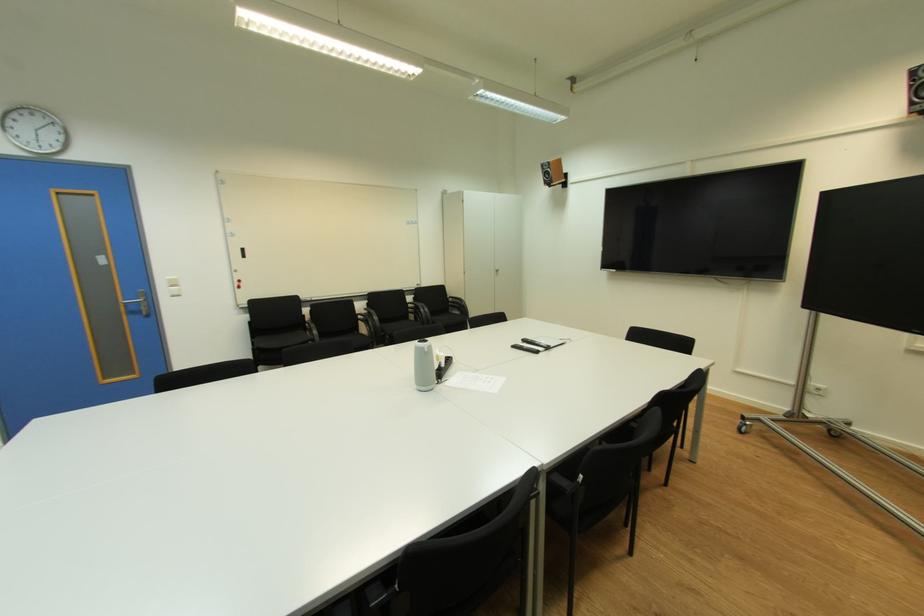
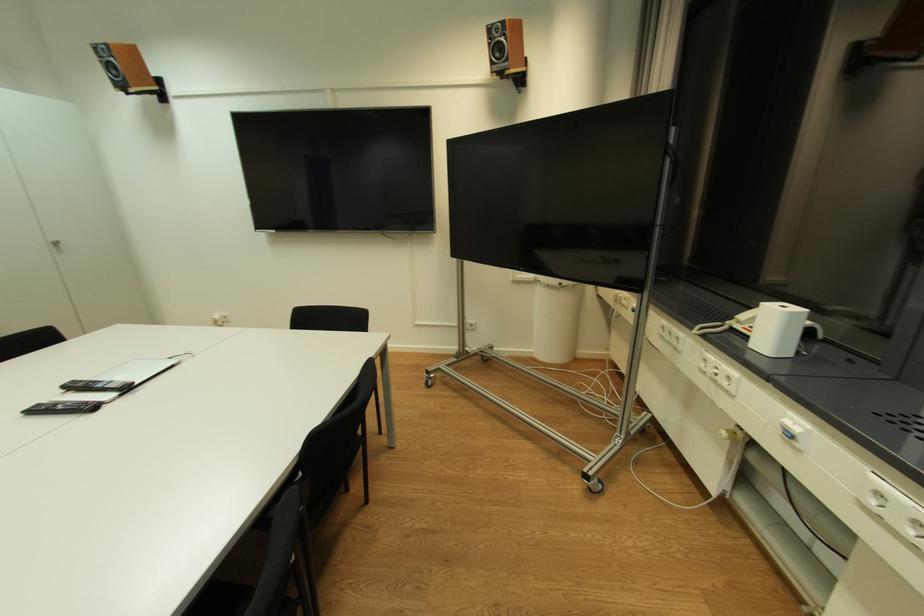
The point at (520, 347) is marked in the first image. Where is the corresponding point in the second image?

(43, 411)